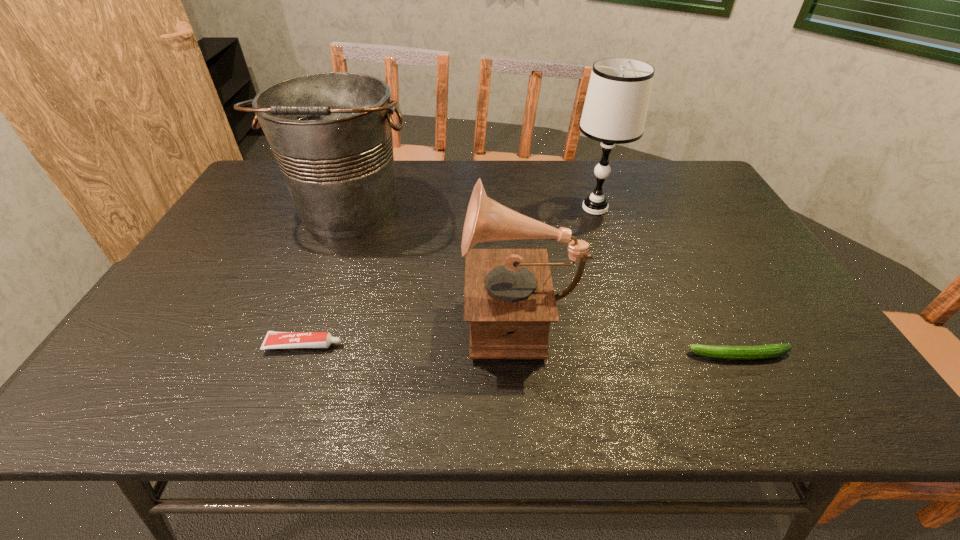
This screenshot has width=960, height=540. Identify the location of the fourth object from left to right. pos(615,109).

Where is `bucket`? Image resolution: width=960 pixels, height=540 pixels. bucket is located at coordinates (331, 133).

Where is `record player`? The height and width of the screenshot is (540, 960). record player is located at coordinates (509, 300).

The width and height of the screenshot is (960, 540). I want to click on toothpaste, so click(274, 340).

This screenshot has width=960, height=540. What are the coordinates of `zucchini` in the screenshot? It's located at (771, 350).

The height and width of the screenshot is (540, 960). What are the coordinates of `free space located on the right of the table lamp` in the screenshot? It's located at (690, 208).

Where is `vacant area located 0.150m on the left of the bucket`? vacant area located 0.150m on the left of the bucket is located at coordinates (237, 210).

The image size is (960, 540). Find the location of `free space located on the horn of the record player`. free space located on the horn of the record player is located at coordinates (368, 313).

This screenshot has width=960, height=540. I want to click on free space located on the horn of the record player, so click(x=304, y=313).

Where is `free spot located on the horn of the record player`? free spot located on the horn of the record player is located at coordinates (333, 313).